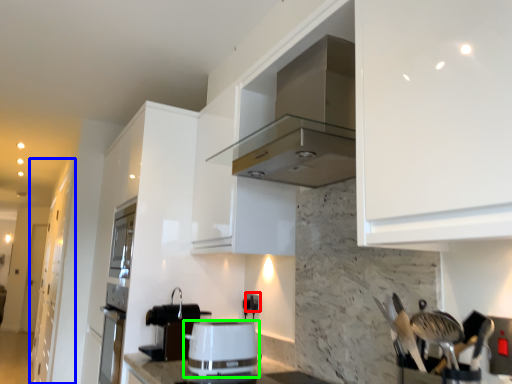
Question: Considering the real-world distances, which object is farthest from electric outlet (highlighted by a red box)? cabinetry (highlighted by a blue box) or kitchen appliance (highlighted by a green box)?

Choices:
 (A) cabinetry
 (B) kitchen appliance

Answer: (A)